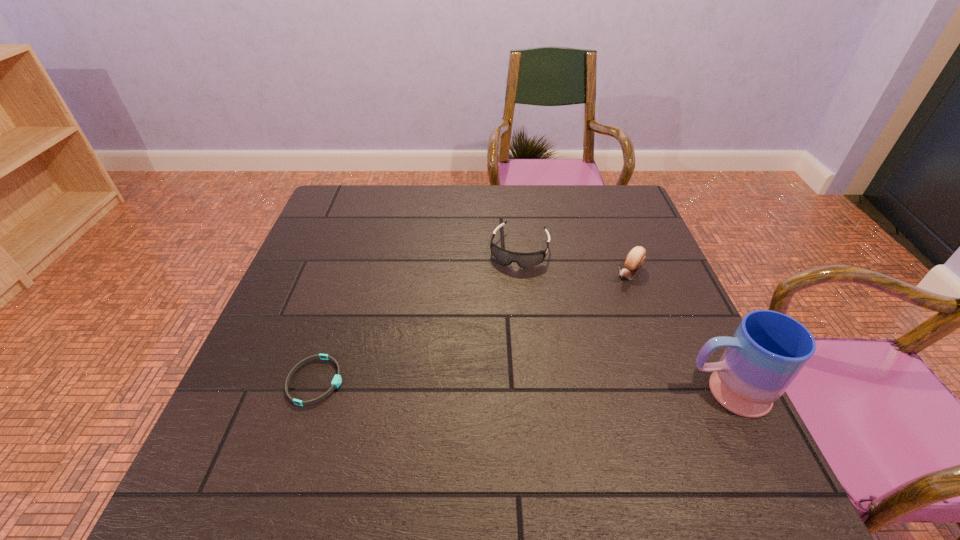
Where is `vacant point located between the second tallest object and the wristband`? vacant point located between the second tallest object and the wristband is located at coordinates (472, 328).

This screenshot has height=540, width=960. I want to click on vacant space that is in between the leftmost object and the second tallest object, so (472, 328).

Identify the location of unoccupied position between the mug and the escargot. (677, 333).

Locate an element on the screen. Image resolution: width=960 pixels, height=540 pixels. vacant region between the third shortest object and the tallest object is located at coordinates (677, 333).

Where is `free space that is in between the goggles and the tallest object`? The height and width of the screenshot is (540, 960). free space that is in between the goggles and the tallest object is located at coordinates (622, 321).

Where is `unoccupied area between the escargot and the second object from left to right`? Image resolution: width=960 pixels, height=540 pixels. unoccupied area between the escargot and the second object from left to right is located at coordinates click(x=574, y=262).

Locate an element on the screen. The height and width of the screenshot is (540, 960). free space between the escargot and the third object from right to left is located at coordinates (574, 262).

Locate an element on the screen. The height and width of the screenshot is (540, 960). free space between the third shortest object and the goggles is located at coordinates (574, 262).

Locate an element on the screen. This screenshot has height=540, width=960. free area in between the tallest object and the leftmost object is located at coordinates (520, 387).

The width and height of the screenshot is (960, 540). What are the coordinates of `object that is the second closest to the tallest object` in the screenshot? It's located at (524, 260).